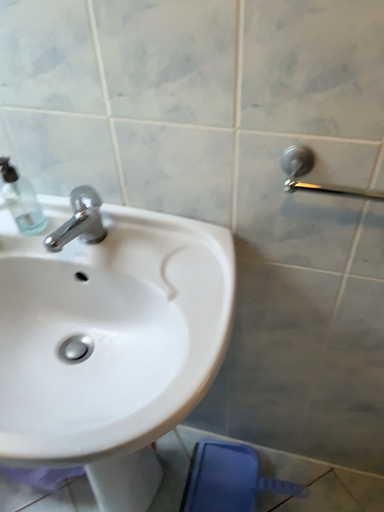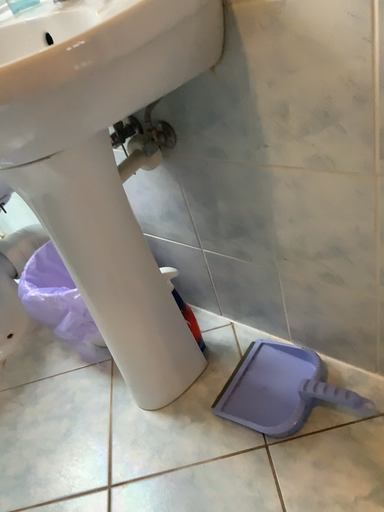
Question: Which way did the camera rotate in the video?

Choices:
 (A) rotated left
 (B) rotated right

Answer: (A)